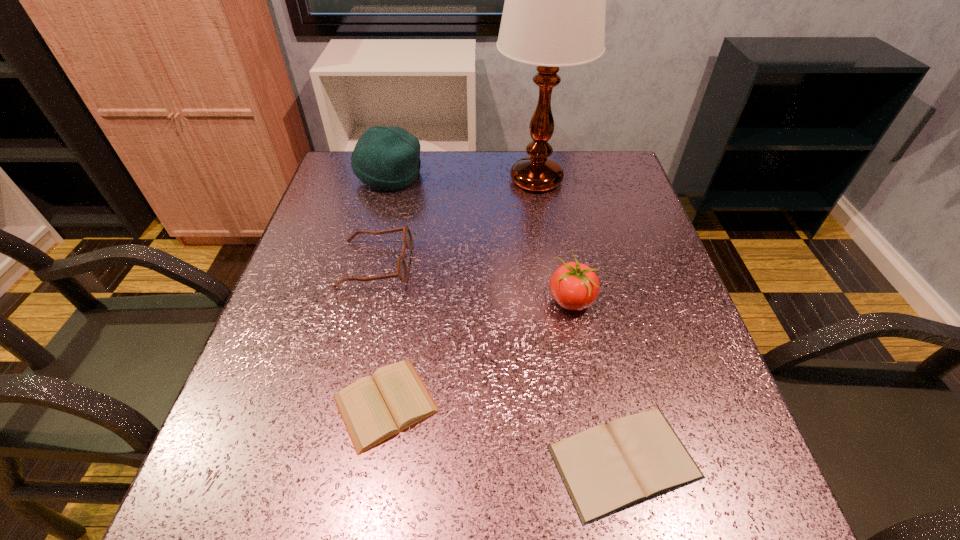
Where is `free spot between the Bible and the tomato`? The image size is (960, 540). free spot between the Bible and the tomato is located at coordinates (598, 381).

I want to click on vacant space in between the table lamp and the diary, so click(x=461, y=292).

In order to click on empty space that is in between the beanie and the Bible in this screenshot , I will do (507, 318).

Locate an element on the screen. The image size is (960, 540). blank region between the table lamp and the diary is located at coordinates (461, 292).

At what (x,y) coordinates should I click in order to perform the action: click on free space between the beanie and the diary. Please return your answer as a coordinate pair (x, y). The height and width of the screenshot is (540, 960). Looking at the image, I should click on (x=388, y=289).

You are a GUI agent. You are given a task and a screenshot of the screen. Output one action in this format:
    pyautogui.click(x=<x>, y=<y>)
    Task: Click on the free point between the second tallest object and the spectacles
    The image size is (960, 540).
    Given the screenshot: What is the action you would take?
    pyautogui.click(x=382, y=219)

This screenshot has width=960, height=540. Identify the location of empty space that is in between the Bible and the third tallest object. (598, 381).

This screenshot has height=540, width=960. What are the coordinates of `vacant region between the diary and the tallest object` in the screenshot? It's located at (461, 292).

Identify which object is located as the second nearest to the tomato. Please provide its 2D coordinates. Your answer should be formatted as a tuple, i.e. [(x, y)], where the tuple contains the x and y coordinates of a point satisfying the conditions above.

[(374, 409)]

Identify which object is the closest to the table lamp. Please provide its 2D coordinates. Your answer should be formatted as a tuple, i.e. [(x, y)], where the tuple contains the x and y coordinates of a point satisfying the conditions above.

[(388, 158)]